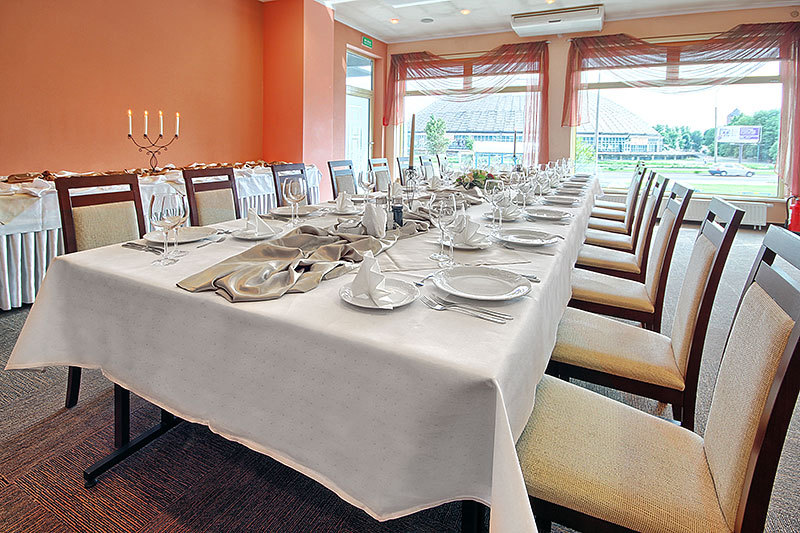
The width and height of the screenshot is (800, 533). In order to click on candle in this screenshot , I will do `click(130, 126)`, `click(146, 127)`, `click(162, 122)`, `click(178, 124)`, `click(412, 150)`, `click(514, 147)`.